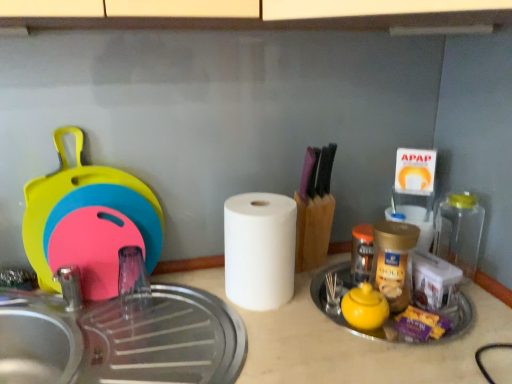
The height and width of the screenshot is (384, 512). I want to click on free point to the right of yellow matte teapot at center-right, so click(x=438, y=327).